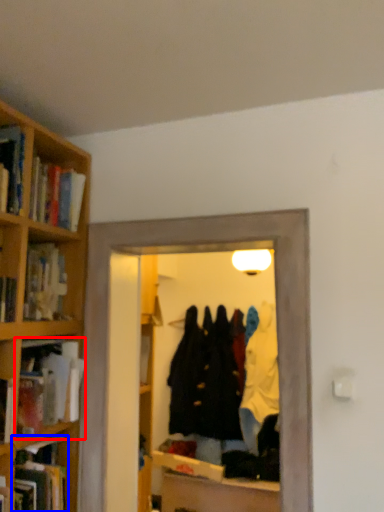
Question: Which point is closer to the camera, book (highlighted by a red box) or book (highlighted by a blue box)?

Choices:
 (A) book
 (B) book

Answer: (B)